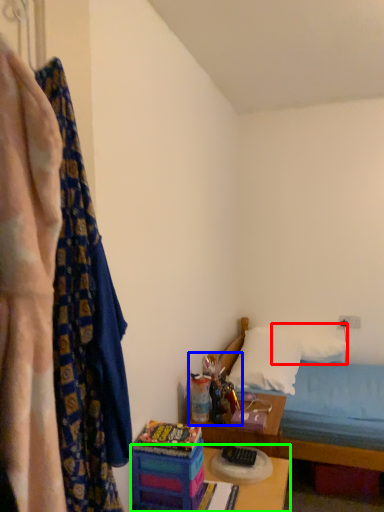
Question: Based on their relative distances, which object is nearer to pillow (highlighted by a red box)? Choose from toy (highlighted by a blue box) and table (highlighted by a green box).

Choices:
 (A) toy
 (B) table

Answer: (A)